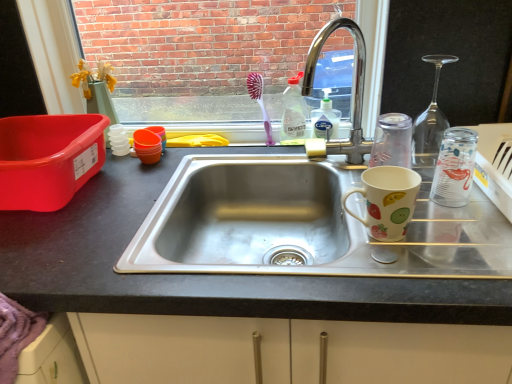
Image resolution: width=512 pixels, height=384 pixels. What are the coordinates of `vacant space behind chrome/metallic faucet at upper center` in the screenshot? It's located at (313, 151).